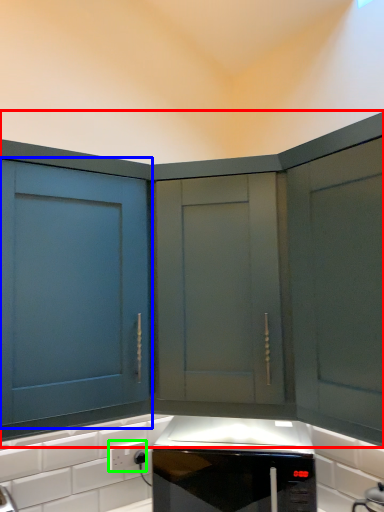
Question: Based on their relative distances, which object is farther from cabinetry (highlighted by a red box)? Choose from cabinetry (highlighted by a blue box) and electric outlet (highlighted by a green box).

Choices:
 (A) cabinetry
 (B) electric outlet

Answer: (B)